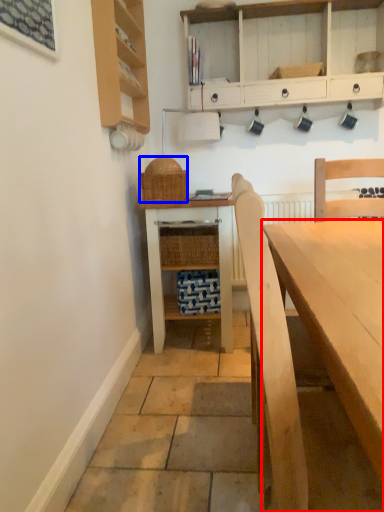
Question: Which point is closer to the camera, desk (highlighted by a red box) or picnic basket (highlighted by a blue box)?

Choices:
 (A) desk
 (B) picnic basket

Answer: (A)